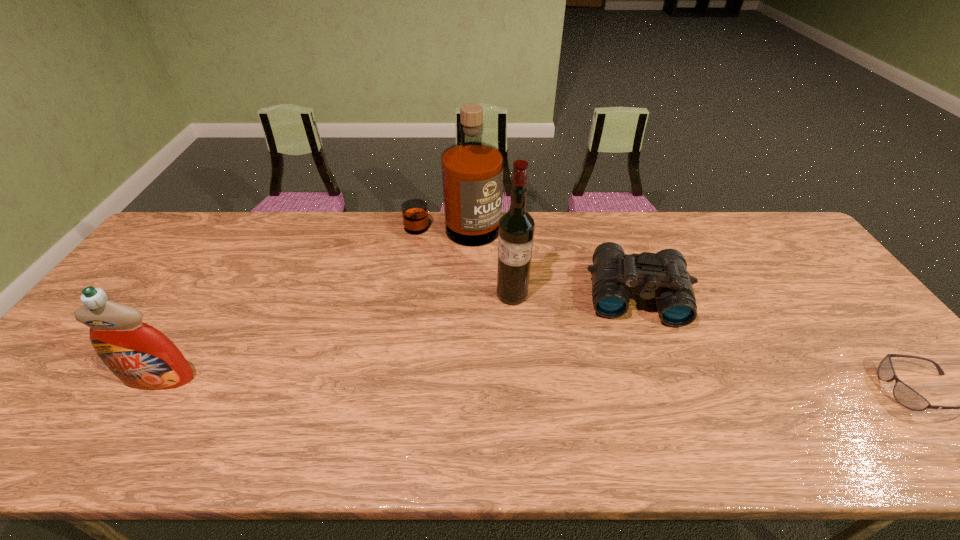
Identify the location of vacant space located through the lenses of the second object from right to left. (644, 373).

Where is `vacant position located 0.240m through the lenses of the second object from right to left`? The height and width of the screenshot is (540, 960). vacant position located 0.240m through the lenses of the second object from right to left is located at coordinates (648, 410).

Find the location of a particular element. The height and width of the screenshot is (540, 960). blank space located on the front label of the farthest object is located at coordinates (453, 274).

Where is `vacant space located 0.330m on the front label of the farthest object`? The height and width of the screenshot is (540, 960). vacant space located 0.330m on the front label of the farthest object is located at coordinates (453, 325).

This screenshot has width=960, height=540. I want to click on vacant region located 0.290m on the front label of the farthest object, so pos(453,314).

This screenshot has height=540, width=960. Identify the location of object at the far edge. pyautogui.click(x=472, y=171).

In order to click on object that is at the near edge in this screenshot , I will do `click(141, 356)`.

In the image, there is a desktop. Where is `free space at the far edge`? free space at the far edge is located at coordinates (658, 242).

You are a GUI agent. You are given a task and a screenshot of the screen. Output one action in this format:
    pyautogui.click(x=<x>, y=<y>)
    Task: Click on the vacant space at the near edge of the desktop
    The image size is (960, 540).
    Given the screenshot: What is the action you would take?
    pyautogui.click(x=276, y=386)

The height and width of the screenshot is (540, 960). Find the location of `free space at the left edge`. free space at the left edge is located at coordinates (140, 307).